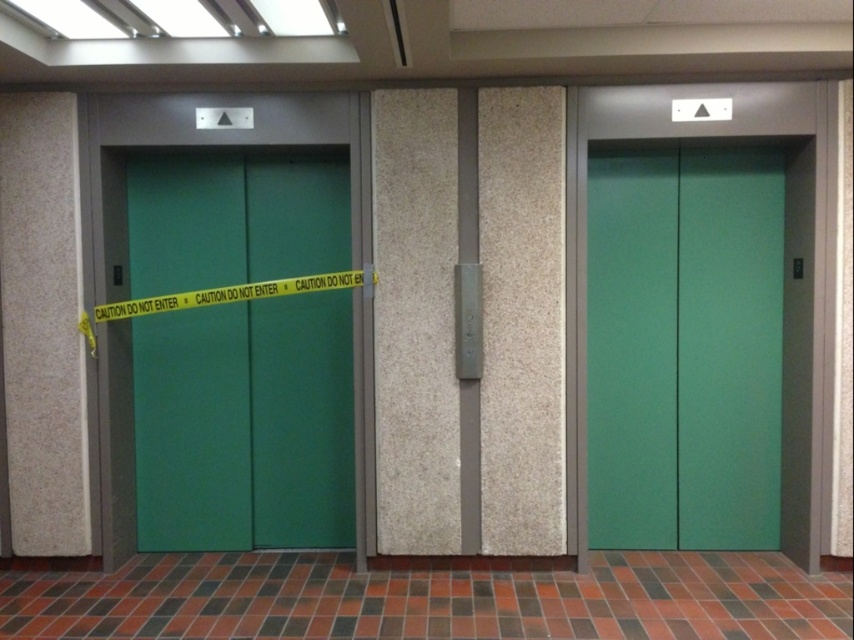
Question: Which of the following is the farthest from the observer?

Choices:
 (A) (705, 301)
 (B) (249, 180)

Answer: (B)

Question: Can you confirm if green matte elevator doors at left is bigger than green matte elevator doors at center?

Choices:
 (A) no
 (B) yes

Answer: (B)

Question: Which of the following is the farthest from the observer?

Choices:
 (A) green matte elevator doors at left
 (B) green matte elevator doors at center

Answer: (A)

Question: Observing the image, what is the correct spatial positioning of green matte elevator doors at left in reference to green matte elevator doors at center?

Choices:
 (A) above
 (B) below

Answer: (B)

Question: Which of the following is the closest to the observer?

Choices:
 (A) green matte elevator doors at left
 (B) green matte elevator doors at center

Answer: (B)

Question: Can you confirm if green matte elevator doors at left is positioned above green matte elevator doors at center?

Choices:
 (A) yes
 (B) no

Answer: (B)